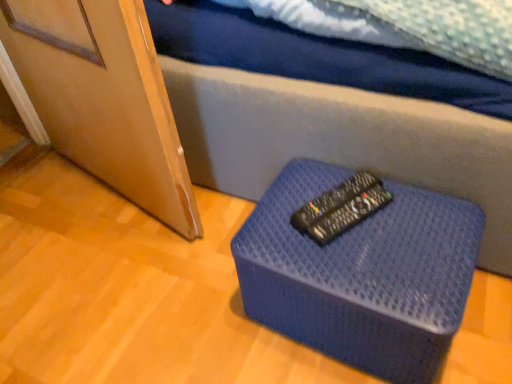
What are the coordinates of `free space above blue textured ottoman at center (from a real-world perspective)` in the screenshot? It's located at (360, 234).